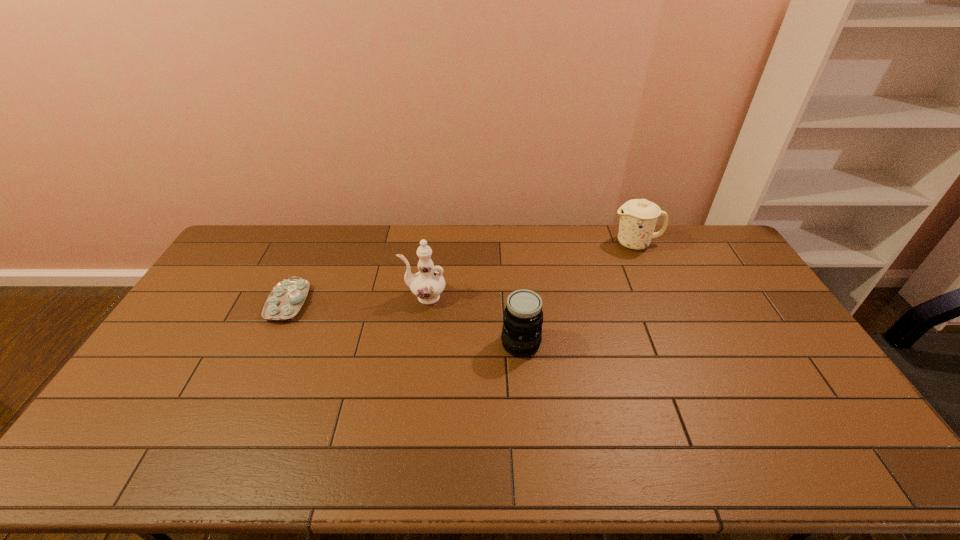
Find the location of a particular element. The width and height of the screenshot is (960, 540). empty space between the second chinaware from right to left and the leftmost chinaware is located at coordinates (356, 300).

Where is `free space between the second chinaware from left to right and the telephoto lens`? free space between the second chinaware from left to right and the telephoto lens is located at coordinates (472, 320).

This screenshot has height=540, width=960. What are the coordinates of `object that is the closest to the telephoto lens` in the screenshot? It's located at (427, 284).

Choose which object is the third nearest neighbor to the second chinaware from left to right. Please provide its 2D coordinates. Your answer should be formatted as a tuple, i.e. [(x, y)], where the tuple contains the x and y coordinates of a point satisfying the conditions above.

[(638, 217)]

Point out which chinaware is positioned as the second nearest to the nearest object. Please provide its 2D coordinates. Your answer should be formatted as a tuple, i.e. [(x, y)], where the tuple contains the x and y coordinates of a point satisfying the conditions above.

[(638, 217)]

Locate an element on the screen. The height and width of the screenshot is (540, 960). chinaware that can be found as the closest to the second object from left to right is located at coordinates (286, 299).

Where is `free space that satisfies the following two spatial constraints: 1. at the spout of the second chinaware from right to left; 2. on the front side of the leftmost object`? This screenshot has width=960, height=540. free space that satisfies the following two spatial constraints: 1. at the spout of the second chinaware from right to left; 2. on the front side of the leftmost object is located at coordinates (423, 303).

Find the location of a particular element. This screenshot has height=540, width=960. vacant region that satisfies the following two spatial constraints: 1. at the spout of the second chinaware from left to right; 2. on the right side of the nearest object is located at coordinates (418, 343).

The height and width of the screenshot is (540, 960). Identify the location of free location that satisfies the following two spatial constraints: 1. at the spout of the third object from left to right; 2. on the right side of the third object from right to left. tap(418, 343).

Locate an element on the screen. This screenshot has width=960, height=540. vacant space that satisfies the following two spatial constraints: 1. at the spout of the second chinaware from right to left; 2. on the front side of the leftmost object is located at coordinates click(423, 303).